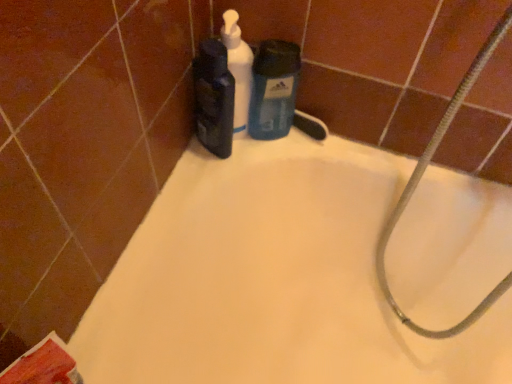
Locate an element on the screen. This screenshot has width=512, height=384. vacant space to the right of blue matte liquid soap at center, which ranks as the 1th cleaning product in right-to-left order is located at coordinates pos(362,153).